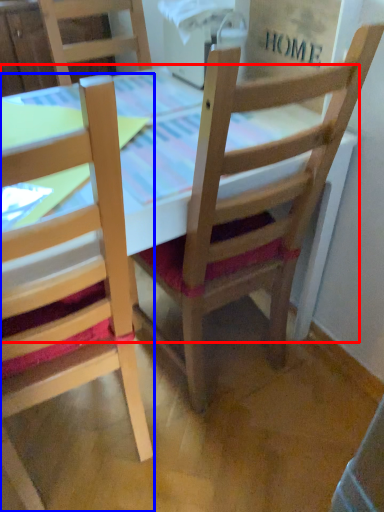
Question: Which object appears farthest to the camera in this image, table (highlighted by a red box) or chair (highlighted by a blue box)?

Choices:
 (A) table
 (B) chair

Answer: (A)